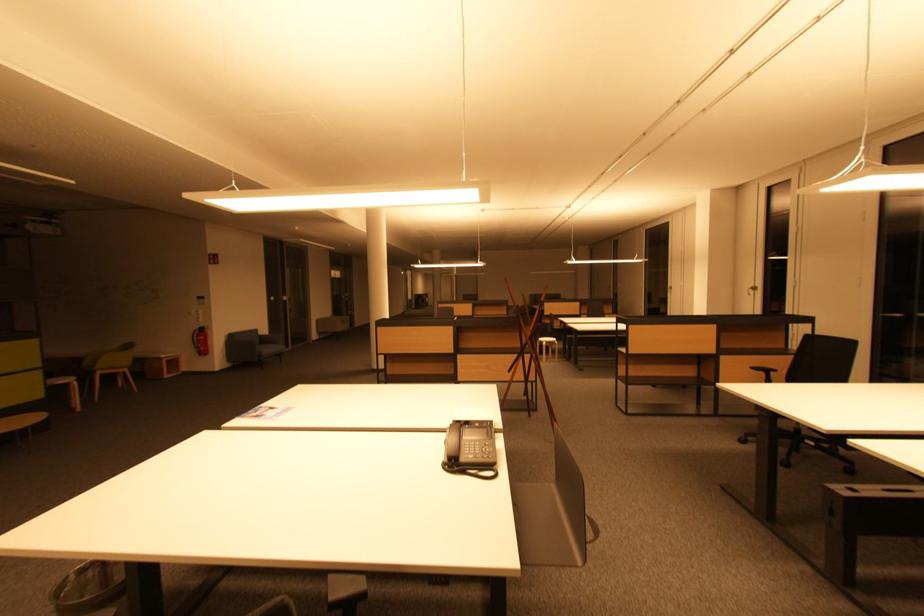
The width and height of the screenshot is (924, 616). Describe the element at coordinates (270, 349) in the screenshot. I see `the sofa sitting surface` at that location.